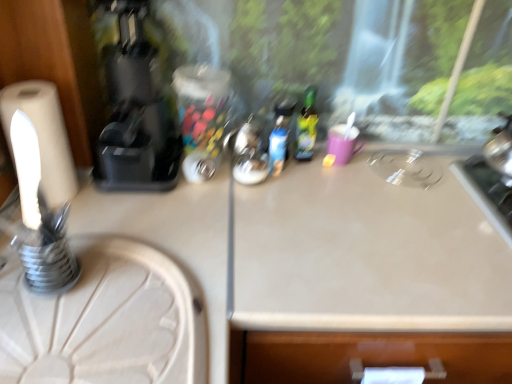
Where is `matte plastic bottle at center, which is the 1th bottle from left to right`? Image resolution: width=512 pixels, height=384 pixels. matte plastic bottle at center, which is the 1th bottle from left to right is located at coordinates (278, 144).

This screenshot has height=384, width=512. Describe the element at coordinates (135, 111) in the screenshot. I see `black plastic coffee machine at left` at that location.

This screenshot has width=512, height=384. In order to click on green glass bottle at center, the second bottle positioned from the left in this screenshot , I will do [x=306, y=126].

Is white wood round table at lower left with matte plastic bottle at center, which is the 2th bottle from right to left?

No, white wood round table at lower left is not beside matte plastic bottle at center, which is the 2th bottle from right to left.

Is matte plastic bottle at center, which is the 1th bottle from left to right, completely or partially inside white wood round table at lower left?

That's incorrect, matte plastic bottle at center, which is the 1th bottle from left to right, is not inside white wood round table at lower left.

Which object is further away from the camera taking this photo, white wood round table at lower left or matte plastic bottle at center, which is the 2th bottle from right to left?

matte plastic bottle at center, which is the 2th bottle from right to left, is further away from the camera.

Which is behind, point (312, 123) or point (161, 161)?

Point (312, 123)

From the image's perspective, which is above, green glass bottle at center, the second bottle positioned from the left, or black plastic coffee machine at left?

black plastic coffee machine at left.

Is green glass bottle at center, the second bottle positioned from the left, wider or thinner than black plastic coffee machine at left?

Clearly, green glass bottle at center, the second bottle positioned from the left, has less width compared to black plastic coffee machine at left.

Looking at the image, does green glass bottle at center, which is counted as the first bottle, starting from the right, seem bigger or smaller compared to black plastic coffee machine at left?

Clearly, green glass bottle at center, which is counted as the first bottle, starting from the right, is smaller in size than black plastic coffee machine at left.

In the image, is white matte toilet paper at left positioned in front of or behind beige laminate counter top at center?

Clearly, white matte toilet paper at left is behind beige laminate counter top at center.

The height and width of the screenshot is (384, 512). I want to click on counter top below the white matte toilet paper at left (from the image's perspective), so click(x=366, y=254).

Is beige laminate counter top at center surrounded by white matte toilet paper at left?

No, beige laminate counter top at center is not a part of white matte toilet paper at left.

From their relative heights in the image, would you say white matte toilet paper at left is taller or shorter than beige laminate counter top at center?

Clearly, white matte toilet paper at left is shorter compared to beige laminate counter top at center.

Can you confirm if white matte toilet paper at left is wider than white wood round table at lower left?

In fact, white matte toilet paper at left might be narrower than white wood round table at lower left.

Considering the relative sizes of white matte toilet paper at left and white wood round table at lower left in the image provided, is white matte toilet paper at left bigger than white wood round table at lower left?

No, white matte toilet paper at left is not bigger than white wood round table at lower left.

In terms of height, does white matte toilet paper at left look taller or shorter compared to white wood round table at lower left?

Considering their sizes, white matte toilet paper at left has more height than white wood round table at lower left.

In the scene shown: How many degrees apart are the facing directions of white matte toilet paper at left and white wood round table at lower left?

The angle between the facing direction of white matte toilet paper at left and the facing direction of white wood round table at lower left is 93.5 degrees.

From a real-world perspective, which is physically below, matte plastic bottle at center, which is the 2th bottle from right to left, or white wood round table at lower left?

From a 3D spatial view, white wood round table at lower left is below.

From their relative heights in the image, would you say matte plastic bottle at center, which is the 2th bottle from right to left, is taller or shorter than white wood round table at lower left?

matte plastic bottle at center, which is the 2th bottle from right to left, is shorter than white wood round table at lower left.

Can white wood round table at lower left be found inside matte plastic bottle at center, which is the 2th bottle from right to left?

No, white wood round table at lower left is located outside of matte plastic bottle at center, which is the 2th bottle from right to left.

How many degrees apart are the facing directions of matte plastic bottle at center, which is the 1th bottle from left to right, and beige laminate counter top at center?

8.46 degrees.

Locate an element on the screen. The width and height of the screenshot is (512, 384). counter top that appears below the matte plastic bottle at center, which is the 2th bottle from right to left (from the image's perspective) is located at coordinates (366, 254).

Between matte plastic bottle at center, which is the 1th bottle from left to right, and beige laminate counter top at center, which one appears on the left side from the viewer's perspective?

matte plastic bottle at center, which is the 1th bottle from left to right.

Can beige laminate counter top at center be found inside matte plastic bottle at center, which is the 1th bottle from left to right?

Actually, beige laminate counter top at center is outside matte plastic bottle at center, which is the 1th bottle from left to right.

Considering the relative sizes of matte plastic bottle at center, which is the 1th bottle from left to right, and green glass bottle at center, the second bottle positioned from the left, in the image provided, is matte plastic bottle at center, which is the 1th bottle from left to right, smaller than green glass bottle at center, the second bottle positioned from the left,?

Yes, matte plastic bottle at center, which is the 1th bottle from left to right, is smaller than green glass bottle at center, the second bottle positioned from the left.

Consider the image. Is green glass bottle at center, which is counted as the first bottle, starting from the right, at the back of matte plastic bottle at center, which is the 2th bottle from right to left?

No, matte plastic bottle at center, which is the 2th bottle from right to left, is not facing the opposite direction of green glass bottle at center, which is counted as the first bottle, starting from the right.

Between matte plastic bottle at center, which is the 1th bottle from left to right, and green glass bottle at center, which is counted as the first bottle, starting from the right, which one appears on the left side from the viewer's perspective?

Positioned to the left is matte plastic bottle at center, which is the 1th bottle from left to right.

How many degrees apart are the facing directions of matte plastic bottle at center, which is the 1th bottle from left to right, and green glass bottle at center, the second bottle positioned from the left?

The angular difference between matte plastic bottle at center, which is the 1th bottle from left to right, and green glass bottle at center, the second bottle positioned from the left, is 5.5e-05 degrees.

Identify the location of round table below the matte plastic bottle at center, which is the 2th bottle from right to left (from a real-world perspective). The height and width of the screenshot is (384, 512). (103, 321).

From the image's perspective, which bottle is the 1st one below the black plastic coffee machine at left? Please provide its 2D coordinates.

[(306, 126)]

Which object lies further to the anchor point white wood round table at lower left, matte plastic bottle at center, which is the 1th bottle from left to right, or white matte toilet paper at left?

matte plastic bottle at center, which is the 1th bottle from left to right.

Considering their positions, is black plastic coffee machine at left positioned closer to white wood round table at lower left than matte plastic bottle at center, which is the 1th bottle from left to right?

Based on the image, black plastic coffee machine at left appears to be nearer to white wood round table at lower left.

Estimate the real-world distances between objects in this image. Which object is further from green glass bottle at center, the second bottle positioned from the left, matte plastic bottle at center, which is the 2th bottle from right to left, or black plastic coffee machine at left?

black plastic coffee machine at left is positioned further to the anchor green glass bottle at center, the second bottle positioned from the left.

From the image, which object appears to be farther from matte plastic bottle at center, which is the 2th bottle from right to left, white wood round table at lower left or beige laminate counter top at center?

Based on the image, white wood round table at lower left appears to be further to matte plastic bottle at center, which is the 2th bottle from right to left.

Considering their positions, is black plastic coffee machine at left positioned further to white matte toilet paper at left than green glass bottle at center, which is counted as the first bottle, starting from the right?

The object further to white matte toilet paper at left is green glass bottle at center, which is counted as the first bottle, starting from the right.

Estimate the real-world distances between objects in this image. Which object is further from matte plastic bottle at center, which is the 2th bottle from right to left, green glass bottle at center, which is counted as the first bottle, starting from the right, or beige laminate counter top at center?

beige laminate counter top at center is positioned further to the anchor matte plastic bottle at center, which is the 2th bottle from right to left.

Considering their positions, is beige laminate counter top at center positioned further to white matte toilet paper at left than green glass bottle at center, the second bottle positioned from the left?

green glass bottle at center, the second bottle positioned from the left.

Which object lies nearer to the anchor point white wood round table at lower left, green glass bottle at center, the second bottle positioned from the left, or beige laminate counter top at center?

The object closer to white wood round table at lower left is beige laminate counter top at center.

Locate an element on the screen. coffee machine located between white wood round table at lower left and beige laminate counter top at center in the left-right direction is located at coordinates (x=135, y=111).

Find the location of a particular element. Image resolution: width=512 pixels, height=384 pixels. bottle between green glass bottle at center, which is counted as the first bottle, starting from the right, and beige laminate counter top at center, in the vertical direction is located at coordinates (278, 144).

Find the location of a particular element. This screenshot has width=512, height=384. bottle between white matte toilet paper at left and green glass bottle at center, the second bottle positioned from the left is located at coordinates (278, 144).

The height and width of the screenshot is (384, 512). Identify the location of round table situated between white matte toilet paper at left and green glass bottle at center, which is counted as the first bottle, starting from the right, from left to right. (103, 321).